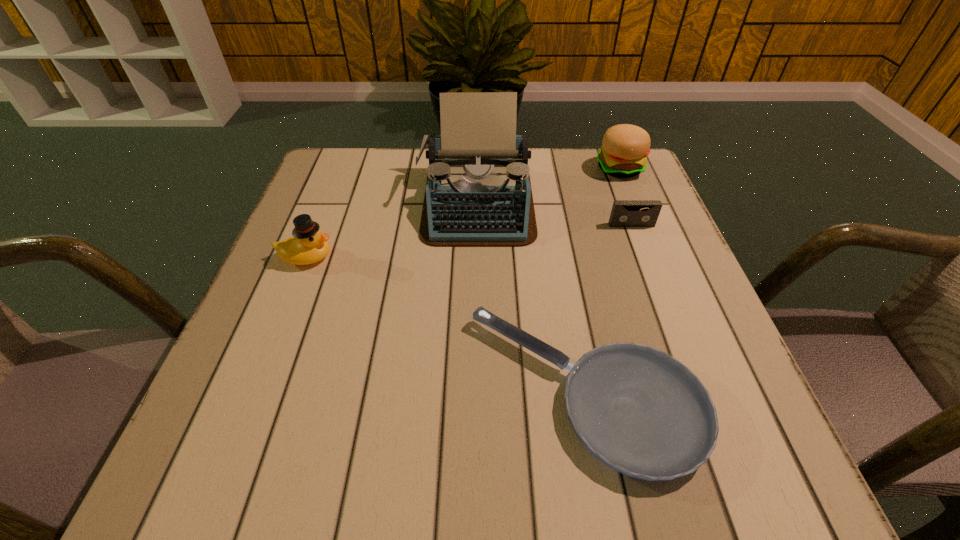
This screenshot has width=960, height=540. I want to click on vacant space that satisfies the following two spatial constraints: 1. on the front-facing side of the videotape; 2. on the front-facing side of the leftmost object, so click(643, 257).

This screenshot has width=960, height=540. In order to click on vacant space that satisfies the following two spatial constraints: 1. on the typing side of the tallest object; 2. on the front-facing side of the leftmost object in this screenshot , I will do `click(476, 257)`.

The width and height of the screenshot is (960, 540). What are the coordinates of `vacant space that satisfies the following two spatial constraints: 1. on the typing side of the tallest object; 2. on the front-facing side of the leftmost object` in the screenshot? It's located at (x=476, y=257).